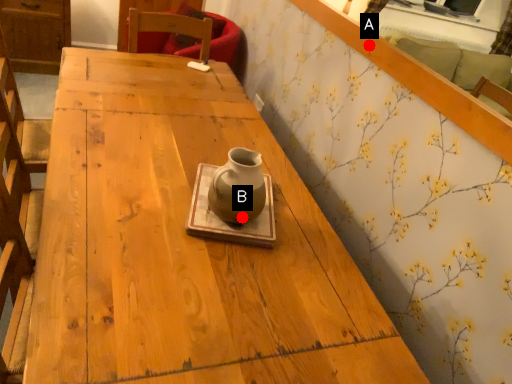
Question: Two points are circled on the image, labeled by A and B beside each circle. Which point is farther to the camera?

Choices:
 (A) A is further
 (B) B is further

Answer: (A)